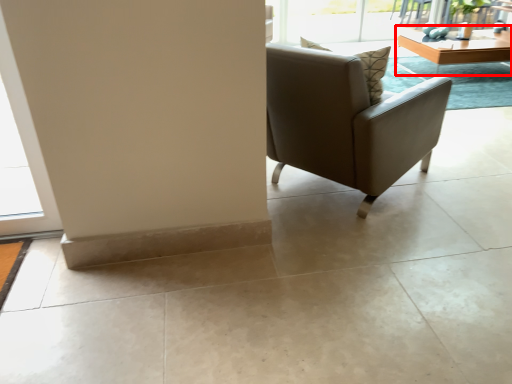
Question: Observing the image, what is the correct spatial positioning of table (annotated by the red box) in reference to chair?

Choices:
 (A) right
 (B) left

Answer: (A)